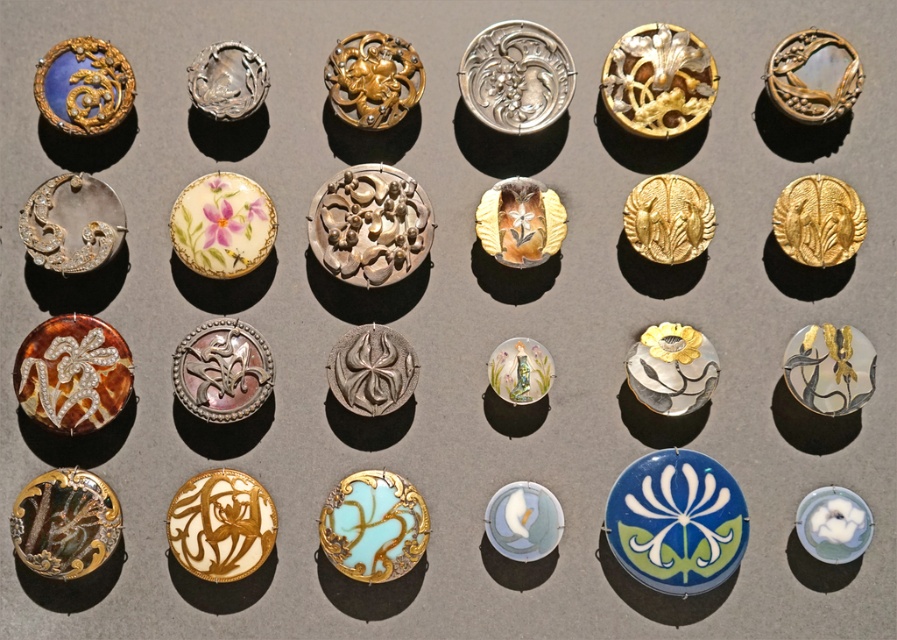
Question: Is turquoise enamel brooch at center wider than gold textured leaf at center?

Choices:
 (A) no
 (B) yes

Answer: (B)

Question: Is matte silver brooch at upper left below white glossy flower at lower right?

Choices:
 (A) yes
 (B) no

Answer: (B)

Question: Does silver/gold textured brooch at center appear on the right side of matte silver brooch at center?

Choices:
 (A) no
 (B) yes

Answer: (B)

Question: Which point is farther to the camera?

Choices:
 (A) gold textured leaf at center
 (B) matte silver floral brooch at center
 (C) matte gold dragon at upper left

Answer: (C)

Question: Among these points, which one is farthest from the camera?

Choices:
 (A) (790, 182)
 (B) (803, 392)
 (C) (109, 54)

Answer: (C)

Question: Considering the real-world distances, which object is closest to the porcelain floral brooch at center?

Choices:
 (A) gold textured brooch at upper right
 (B) blue glossy flower at center

Answer: (B)